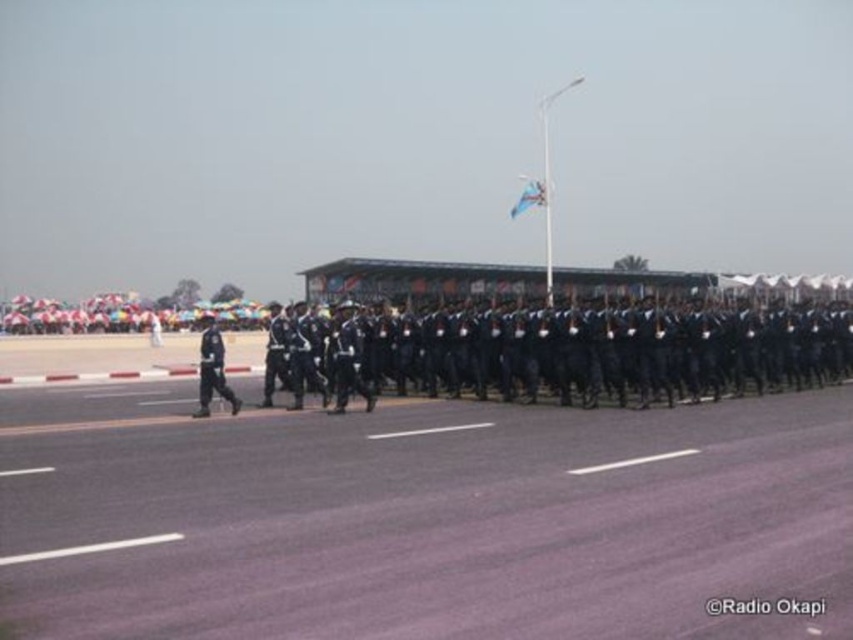
Does black matte uniform at left appear under blue fabric flag at center?

Correct, black matte uniform at left is located below blue fabric flag at center.

Does black matte uniform at left have a lesser width compared to blue fabric flag at center?

Yes, black matte uniform at left is thinner than blue fabric flag at center.

Does point (236, 408) come in front of point (521, 200)?

Yes, point (236, 408) is closer to viewer.

Identify the location of black matte uniform at left. (212, 369).

Is black uniformed soldiers at center shorter than black matte uniform at left?

In fact, black uniformed soldiers at center may be taller than black matte uniform at left.

Describe the element at coordinates (605, 349) in the screenshot. I see `black uniformed soldiers at center` at that location.

What do you see at coordinates (605, 349) in the screenshot? The height and width of the screenshot is (640, 853). I see `black uniformed soldiers at center` at bounding box center [605, 349].

Locate an element on the screen. black uniformed soldiers at center is located at coordinates (605, 349).

Can you confirm if black uniformed soldiers at center is taller than blue fabric flag at center?

Incorrect, black uniformed soldiers at center's height is not larger of blue fabric flag at center's.

The image size is (853, 640). Describe the element at coordinates (605, 349) in the screenshot. I see `black uniformed soldiers at center` at that location.

What are the coordinates of `black uniformed soldiers at center` in the screenshot? It's located at (605, 349).